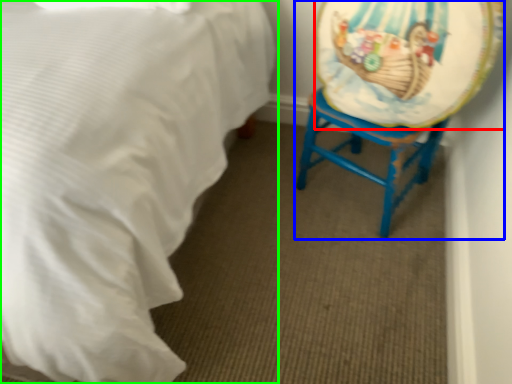
Question: Based on their relative distances, which object is farther from platter (highlighted by a red box)? Choose from swivel chair (highlighted by a blue box) and bed (highlighted by a green box).

Choices:
 (A) swivel chair
 (B) bed

Answer: (B)